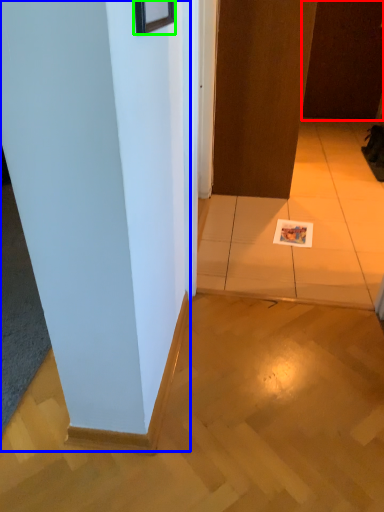
Question: Which is farther away from door (highlighted by a red box)? pillar (highlighted by a blue box) or picture frame (highlighted by a green box)?

Choices:
 (A) pillar
 (B) picture frame

Answer: (B)